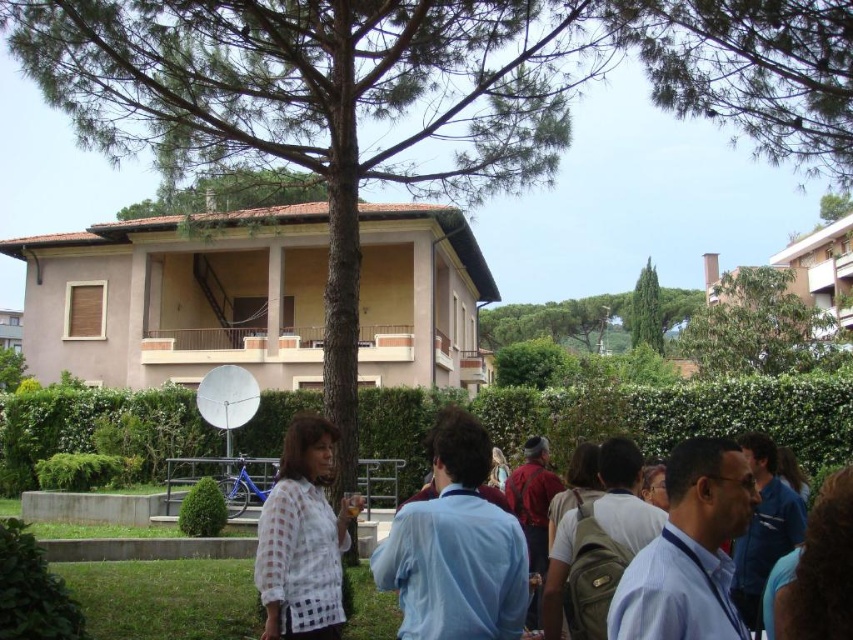
Question: Is the position of green leafy tree at upper center more distant than that of green textured tree at center?

Choices:
 (A) no
 (B) yes

Answer: (A)

Question: Which point is closer to the camera?

Choices:
 (A) (469, 595)
 (B) (294, 180)
 (C) (845, 352)

Answer: (A)

Question: Which point is farther to the camera?

Choices:
 (A) green leafy tree at upper right
 (B) light blue shirt at center
 (C) green textured tree at center

Answer: (C)

Question: Does light blue shirt at center appear over green leafy tree at upper right?

Choices:
 (A) yes
 (B) no

Answer: (B)

Question: Observing the image, what is the correct spatial positioning of light blue shirt at center in reference to green leafy tree at upper right?

Choices:
 (A) left
 (B) right

Answer: (A)

Question: Which object appears farthest from the camera in this image?

Choices:
 (A) green leafy tree at upper center
 (B) light blue shirt at center
 (C) white sheer blouse at center

Answer: (A)